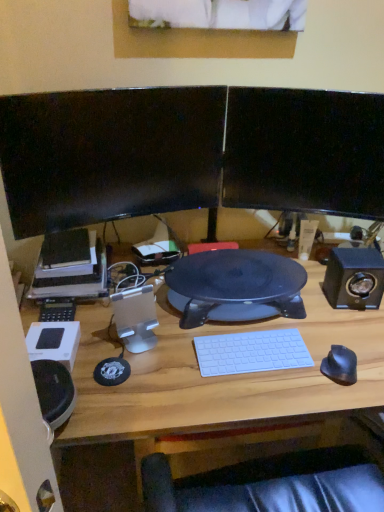
The height and width of the screenshot is (512, 384). In order to click on free spot to the left of white plastic keyboard at center in this screenshot , I will do `click(172, 358)`.